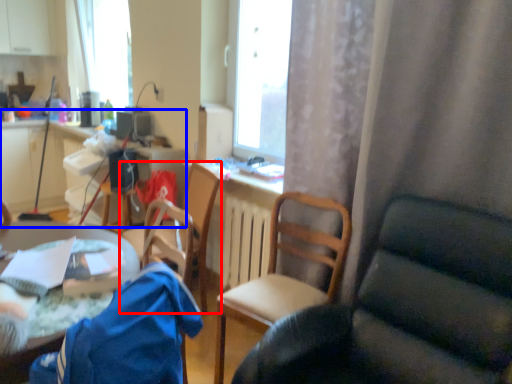
Question: Among these objects, which one is farthest to the camera, chair (highlighted by a red box) or computer desk (highlighted by a blue box)?

Choices:
 (A) chair
 (B) computer desk

Answer: (B)